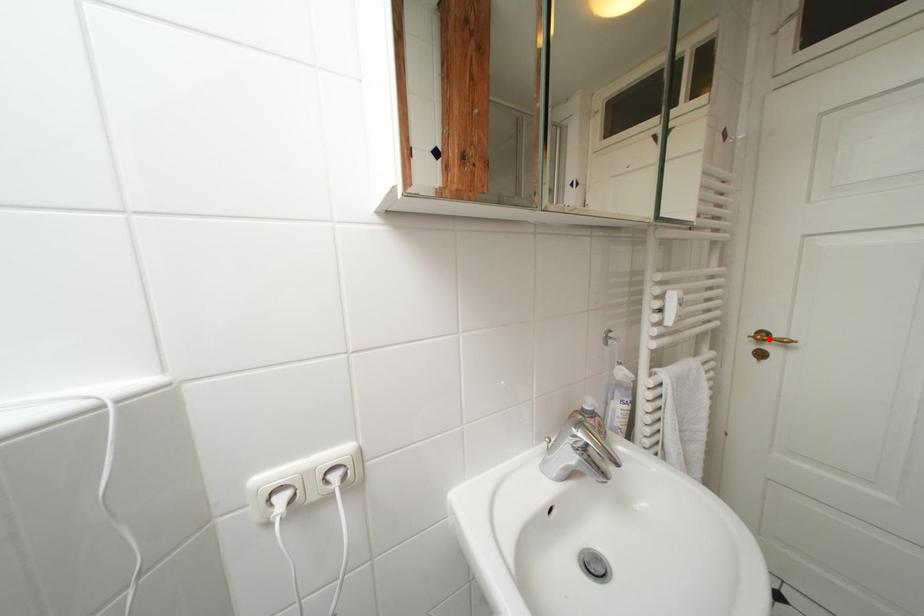
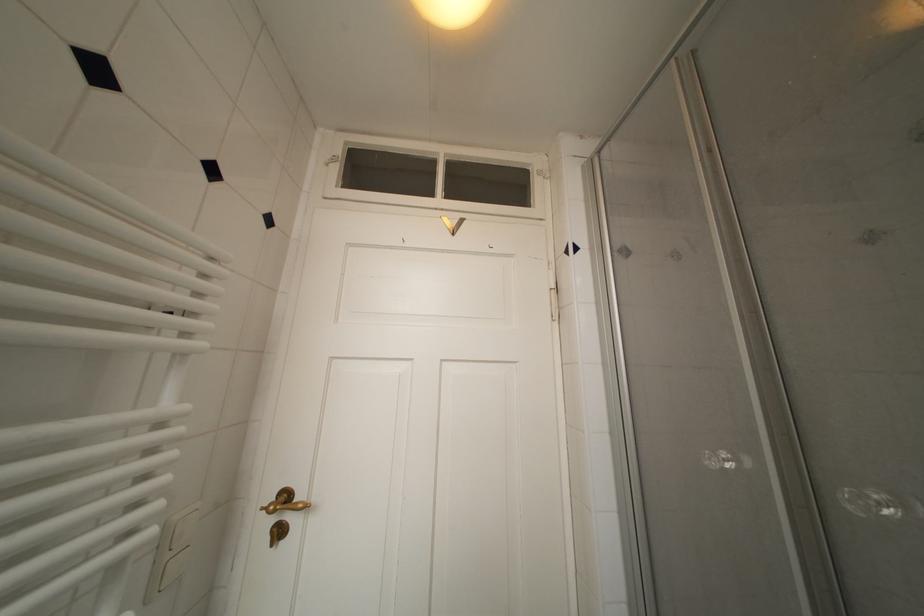
Question: I am providing you with two images of the same scene from different viewpoints. A red point is marked on the first image. Is the red point's position out of view in image 2?

Choices:
 (A) Yes
 (B) No

Answer: (B)